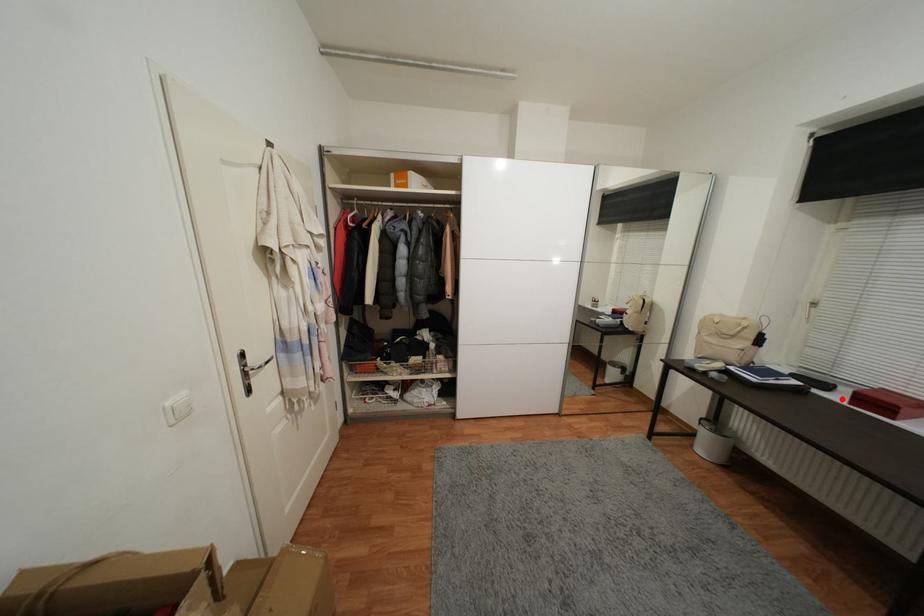
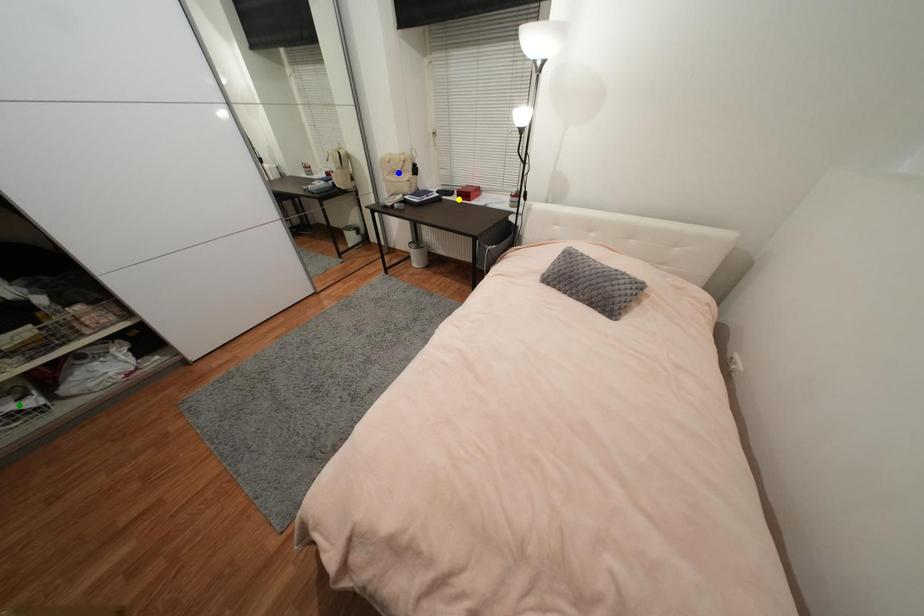
Question: I am providing you with two images of the same scene from different viewpoints. A red point is marked on the first image. You are given multiple points on the second image. Which point in image 2 represents the same 3d spot as the red point in image 1?

Choices:
 (A) green point
 (B) blue point
 (C) yellow point

Answer: (C)